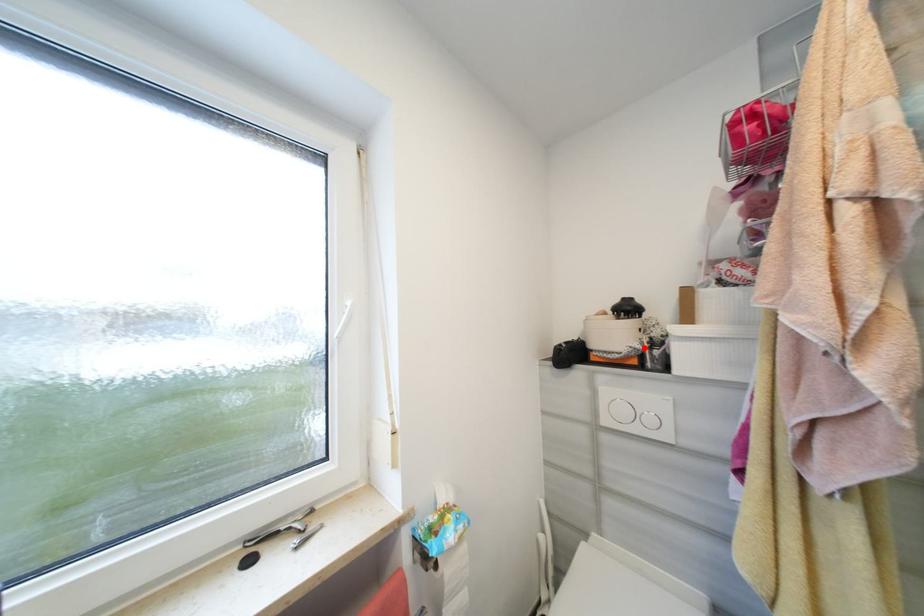
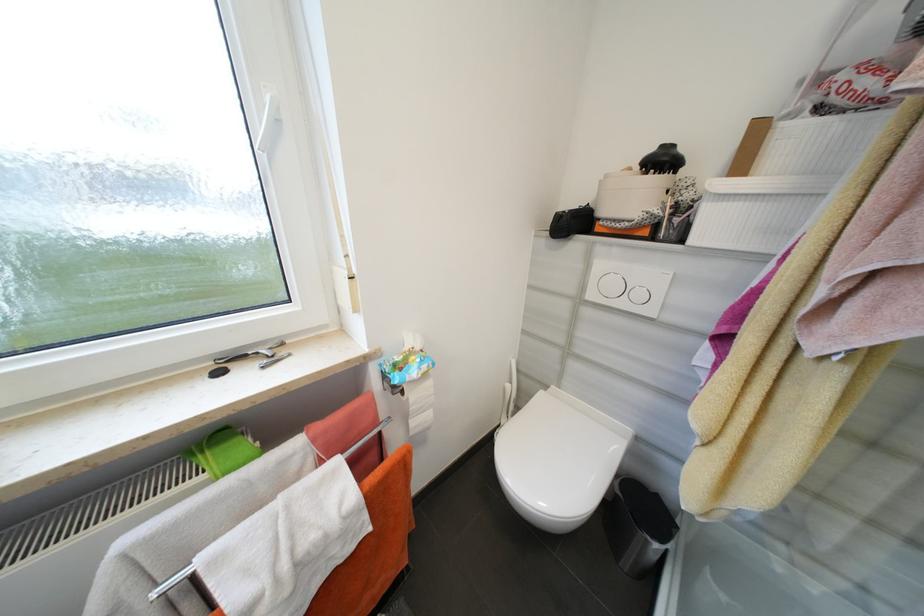
The point at the highlighted location is marked in the first image. Where is the corresponding point in the second image?

(663, 213)